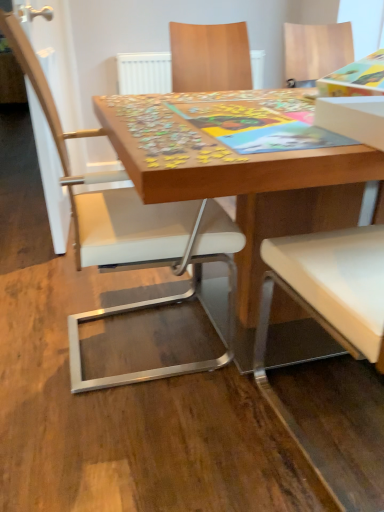
Identify the location of wooden puzzle board at center. The width and height of the screenshot is (384, 512). (237, 178).

Identify the location of wooden puzzle board at center. This screenshot has width=384, height=512. (237, 178).

From the image's perspective, does wooden puzzle pieces at center appear lower than white leather chair at center?

No.

Is wooden puzzle pieces at center far away from white leather chair at center?

wooden puzzle pieces at center is actually quite close to white leather chair at center.

You are a GUI agent. You are given a task and a screenshot of the screen. Output one action in this format:
    pyautogui.click(x=<x>, y=<y>)
    Task: Click on the chair located above the wooden puzzle pieces at center (from a real-world perspective)
    
    Given the screenshot: What is the action you would take?
    pyautogui.click(x=129, y=232)

Is wooden puzzle pieces at center facing towards white leather chair at center?

Yes, wooden puzzle pieces at center is facing white leather chair at center.

Visually, is wooden puzzle board at center positioned to the left or to the right of wooden puzzle pieces at center?

Based on their positions, wooden puzzle board at center is located to the right of wooden puzzle pieces at center.

From a real-world perspective, is wooden puzzle board at center on wooden puzzle pieces at center?

Indeed, from a real-world perspective, wooden puzzle board at center stands above wooden puzzle pieces at center.

Considering the relative sizes of wooden puzzle board at center and wooden puzzle pieces at center in the image provided, is wooden puzzle board at center bigger than wooden puzzle pieces at center?

Correct, wooden puzzle board at center is larger in size than wooden puzzle pieces at center.

Between point (307, 188) and point (28, 77), which one is positioned behind?

Positioned behind is point (307, 188).

Is wooden puzzle board at center aimed at white leather chair at center?

Yes, wooden puzzle board at center is turned towards white leather chair at center.

Between wooden puzzle board at center and white leather chair at center, which one is positioned in front?

wooden puzzle board at center.

Is wooden puzzle board at center taller than white leather chair at center?

In fact, wooden puzzle board at center may be shorter than white leather chair at center.

Image resolution: width=384 pixels, height=512 pixels. Find the location of `chair lying behind the wooden puzzle board at center`. chair lying behind the wooden puzzle board at center is located at coordinates (129, 232).

Is white leather chair at center looking in the opposite direction of wooden puzzle board at center?

Yes.

Considering the relative sizes of white leather chair at center and wooden puzzle board at center in the image provided, is white leather chair at center wider than wooden puzzle board at center?

In fact, white leather chair at center might be narrower than wooden puzzle board at center.

From the image's perspective, is white leather chair at center located beneath wooden puzzle pieces at center?

Yes, from the image's perspective, white leather chair at center is beneath wooden puzzle pieces at center.

Which of these two, white leather chair at center or wooden puzzle pieces at center, is thinner?

Thinner between the two is white leather chair at center.

Considering the relative positions of white leather chair at center and wooden puzzle pieces at center in the image provided, is white leather chair at center to the left or to the right of wooden puzzle pieces at center?

Clearly, white leather chair at center is on the right of wooden puzzle pieces at center in the image.

Does white leather chair at center have a greater height compared to wooden puzzle pieces at center?

Yes, white leather chair at center is taller than wooden puzzle pieces at center.

From a real-world perspective, is wooden puzzle pieces at center on top of wooden puzzle board at center?

Answer: Actually, wooden puzzle pieces at center is physically below wooden puzzle board at center in the real world.

Between wooden puzzle pieces at center and wooden puzzle board at center, which one has less height?

With less height is wooden puzzle pieces at center.

Consider the image. Considering the positions of objects wooden puzzle pieces at center and wooden puzzle board at center in the image provided, who is more to the left, wooden puzzle pieces at center or wooden puzzle board at center?

wooden puzzle pieces at center.

Is point (110, 457) positioned after point (368, 159)?

That is True.

In order to click on plywood that is above the white leather chair at center (from the image's perspective) in this screenshot , I will do `click(130, 417)`.

What are the coordinates of `table on the right of the wooden puzzle pieces at center` in the screenshot? It's located at (237, 178).

Based on the photo, estimate the real-world distances between objects in this image. Which object is further from wooden puzzle board at center, white leather chair at center or wooden puzzle pieces at center?

wooden puzzle pieces at center is further to wooden puzzle board at center.

When comparing their distances from white leather chair at center, does wooden puzzle board at center or wooden puzzle pieces at center seem closer?

wooden puzzle pieces at center is positioned closer to the anchor white leather chair at center.

Looking at the image, which one is located further to wooden puzzle pieces at center, wooden puzzle board at center or white leather chair at center?

wooden puzzle board at center.

Based on their spatial positions, is wooden puzzle pieces at center or white leather chair at center closer to wooden puzzle board at center?

white leather chair at center lies closer to wooden puzzle board at center than the other object.

Considering their positions, is wooden puzzle pieces at center positioned further to white leather chair at center than wooden puzzle board at center?

wooden puzzle board at center is positioned further to the anchor white leather chair at center.

Looking at the image, which one is located closer to wooden puzzle pieces at center, white leather chair at center or wooden puzzle board at center?

white leather chair at center lies closer to wooden puzzle pieces at center than the other object.

Locate an element on the screen. Image resolution: width=384 pixels, height=512 pixels. chair located between wooden puzzle pieces at center and wooden puzzle board at center in the left-right direction is located at coordinates (129, 232).